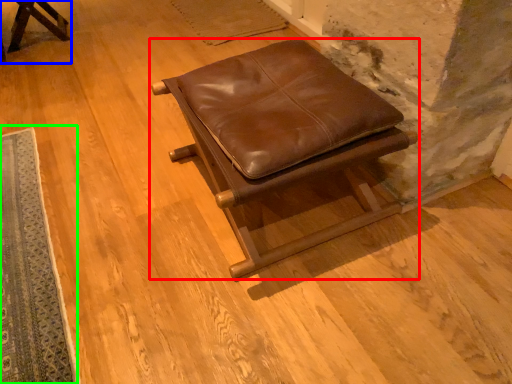
Question: Considering the real-world distances, which object is farthest from furniture (highlighted by a red box)? furniture (highlighted by a blue box) or mat (highlighted by a green box)?

Choices:
 (A) furniture
 (B) mat

Answer: (A)